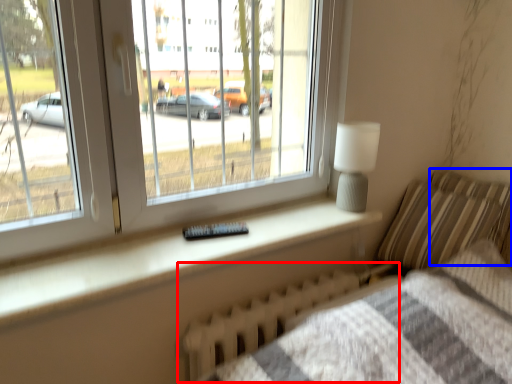
Question: Among these objects, which one is nearest to the camera, radiator (highlighted by a red box) or pillow (highlighted by a blue box)?

Choices:
 (A) radiator
 (B) pillow

Answer: (A)